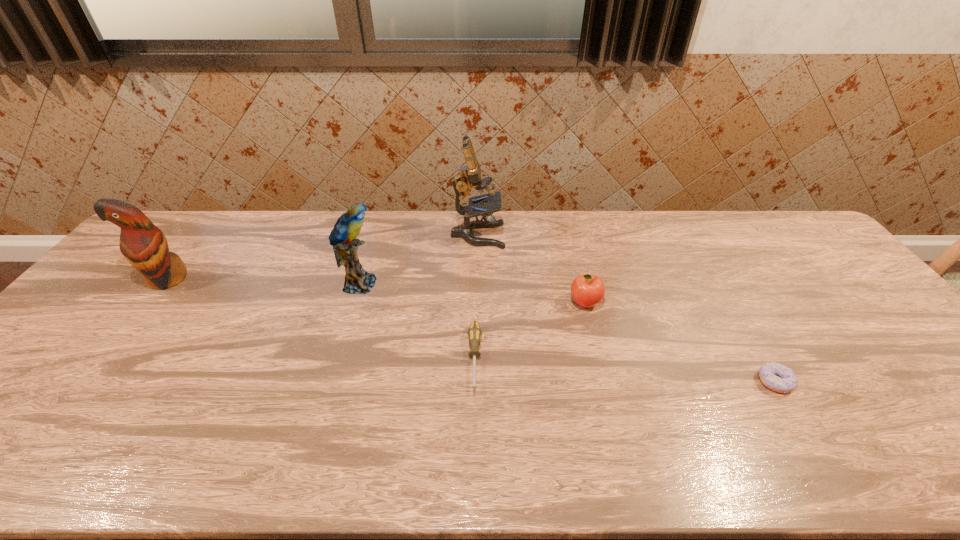
Locate an element on the screen. The height and width of the screenshot is (540, 960). blank space located 0.190m on the face of the fifth object from right to left is located at coordinates (445, 284).

Where is `free point located 0.180m on the front of the apple`? free point located 0.180m on the front of the apple is located at coordinates (601, 367).

I want to click on vacant area situated at the tip of the screwdriver, so click(473, 464).

Locate an element on the screen. This screenshot has width=960, height=540. free point located 0.260m on the left of the doughnut is located at coordinates (650, 382).

Identify the location of object present at the far edge. The height and width of the screenshot is (540, 960). (469, 176).

Where is `object located in the left edge section of the desktop`? This screenshot has width=960, height=540. object located in the left edge section of the desktop is located at coordinates (144, 245).

Where is `vacant space at the far edge of the desktop`? vacant space at the far edge of the desktop is located at coordinates (640, 247).

Locate an element on the screen. Image resolution: width=960 pixels, height=540 pixels. free space at the near edge of the desktop is located at coordinates (397, 442).

At what (x,y) coordinates should I click in order to perform the action: click on free space at the left edge. Please return your answer as a coordinate pair (x, y). This screenshot has height=540, width=960. Looking at the image, I should click on (83, 319).

Where is `vacant space at the right edge of the desktop`? vacant space at the right edge of the desktop is located at coordinates pyautogui.click(x=780, y=253).